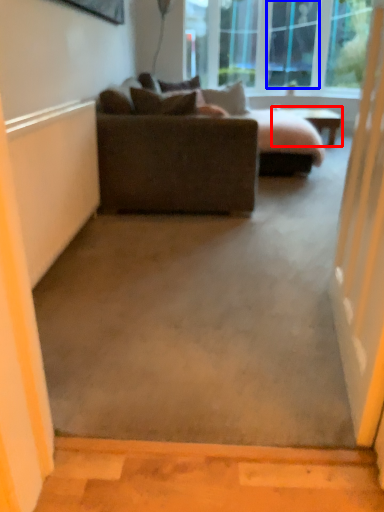
Question: Which object is closer to the camera taking this photo, table (highlighted by a red box) or glass door (highlighted by a blue box)?

Choices:
 (A) table
 (B) glass door

Answer: (A)